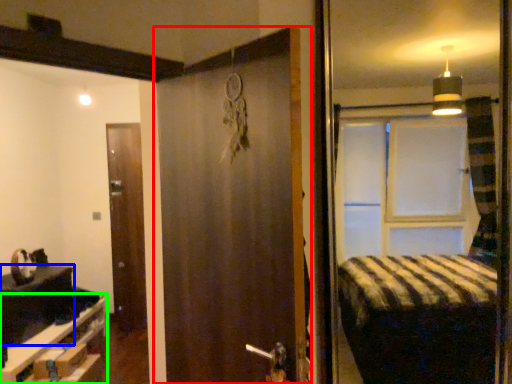
Question: Considering the real-world distances, which object is closest to door (highlighted by a red box)? table (highlighted by a blue box) or furniture (highlighted by a green box).

Choices:
 (A) table
 (B) furniture

Answer: (B)